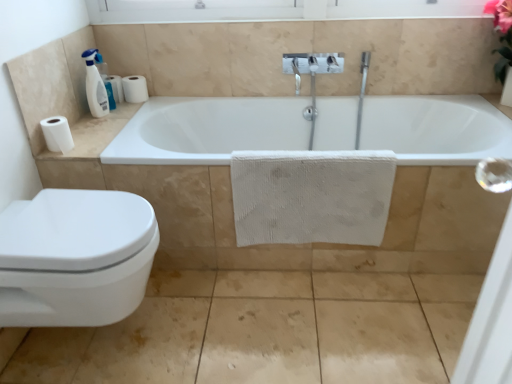
What is the approximate height of white glossy toilet at lower left?

It is 17.34 inches.

In order to face white matte paper towel at left, should I rotate leftwards or rightwards?

Rotate left and turn 19.832 degrees.

Identify the location of white matte toilet paper at left, the 1th toilet paper from the top. This screenshot has height=384, width=512. (116, 87).

Where is `white glossy toilet at lower left`? white glossy toilet at lower left is located at coordinates (74, 257).

From the image's perspective, does white matte paper towel at left appear higher than white textured towel at center?

Yes, from the image's perspective, white matte paper towel at left is above white textured towel at center.

Looking at their sizes, would you say white matte paper towel at left is wider or thinner than white textured towel at center?

Clearly, white matte paper towel at left has more width compared to white textured towel at center.

Is white matte paper towel at left to the left of white textured towel at center from the viewer's perspective?

Yes, white matte paper towel at left is to the left of white textured towel at center.

Considering the relative sizes of white matte toilet paper at upper left, the 2th toilet paper ordered from the bottom, and white plastic bottle at upper left in the image provided, is white matte toilet paper at upper left, the 2th toilet paper ordered from the bottom, wider than white plastic bottle at upper left?

Correct, the width of white matte toilet paper at upper left, the 2th toilet paper ordered from the bottom, exceeds that of white plastic bottle at upper left.

Is white matte toilet paper at upper left, acting as the 2th toilet paper starting from the back, at the right side of white plastic bottle at upper left?

Yes, white matte toilet paper at upper left, acting as the 2th toilet paper starting from the back, is to the right of white plastic bottle at upper left.

From a real-world perspective, which is physically below, white matte toilet paper at upper left, arranged as the 2th toilet paper when viewed from the front, or white plastic bottle at upper left?

In real-world perspective, white matte toilet paper at upper left, arranged as the 2th toilet paper when viewed from the front, is lower.

Is white matte toilet paper at upper left, marked as the 2th toilet paper in a top-to-bottom arrangement, taller than white plastic bottle at upper left?

No, white matte toilet paper at upper left, marked as the 2th toilet paper in a top-to-bottom arrangement, is not taller than white plastic bottle at upper left.

Between white glossy bathtub at center and white matte toilet paper at upper left, the 2th toilet paper ordered from the bottom, which one has more height?

white glossy bathtub at center.

How much distance is there between white glossy bathtub at center and white matte toilet paper at upper left, arranged as the 2th toilet paper when viewed from the front?

white glossy bathtub at center and white matte toilet paper at upper left, arranged as the 2th toilet paper when viewed from the front, are 38.56 inches apart from each other.

Are white glossy bathtub at center and white matte toilet paper at upper left, the 2th toilet paper ordered from the bottom, beside each other?

No, white glossy bathtub at center is not in contact with white matte toilet paper at upper left, the 2th toilet paper ordered from the bottom.

Identify the location of bath below the white matte toilet paper at upper left, marked as the 2th toilet paper in a top-to-bottom arrangement (from the image's perspective). The height and width of the screenshot is (384, 512). (326, 243).

Can you confirm if white matte toilet paper at upper left, acting as the 2th toilet paper starting from the back, is wider than white glossy bathtub at center?

In fact, white matte toilet paper at upper left, acting as the 2th toilet paper starting from the back, might be narrower than white glossy bathtub at center.

Which is nearer, (145,100) or (151,176)?

Point (145,100) appears to be farther away from the viewer than point (151,176).

From the image's perspective, between white matte toilet paper at upper left, acting as the 2th toilet paper starting from the back, and white glossy bathtub at center, who is located below?

white glossy bathtub at center, from the image's perspective.

Considering the positions of objects white matte toilet paper at upper left, acting as the 2th toilet paper starting from the back, and white glossy bathtub at center in the image provided, who is in front, white matte toilet paper at upper left, acting as the 2th toilet paper starting from the back, or white glossy bathtub at center?

white glossy bathtub at center.

Consider the image. Considering the sizes of objects white glossy bathtub at center and white textured towel at center in the image provided, who is bigger, white glossy bathtub at center or white textured towel at center?

Bigger between the two is white glossy bathtub at center.

Locate an element on the screen. Image resolution: width=512 pixels, height=384 pixels. bath towel behind the white glossy bathtub at center is located at coordinates (311, 196).

Which is more to the right, white glossy bathtub at center or white textured towel at center?

Positioned to the right is white glossy bathtub at center.

Between white matte toilet paper at left, the 1th toilet paper from the top, and white glossy toilet at lower left, which one appears on the right side from the viewer's perspective?

white glossy toilet at lower left is more to the right.

From a real-world perspective, is white matte toilet paper at left, the 1th toilet paper from the back, above or below white glossy toilet at lower left?

white matte toilet paper at left, the 1th toilet paper from the back, is above white glossy toilet at lower left.

Is white matte toilet paper at left, positioned as the third toilet paper in front-to-back order, oriented away from white glossy toilet at lower left?

No, white matte toilet paper at left, positioned as the third toilet paper in front-to-back order,'s orientation is not away from white glossy toilet at lower left.

Is white matte toilet paper at left, positioned as the third toilet paper in front-to-back order, taller or shorter than white glossy toilet at lower left?

Clearly, white matte toilet paper at left, positioned as the third toilet paper in front-to-back order, is shorter compared to white glossy toilet at lower left.

Is white glossy toilet at lower left positioned far away from white matte paper towel at left?

No, white glossy toilet at lower left is in close proximity to white matte paper towel at left.

Does white glossy toilet at lower left come in front of white matte paper towel at left?

Yes, it is in front of white matte paper towel at left.

Can you confirm if white glossy toilet at lower left is shorter than white matte paper towel at left?

In fact, white glossy toilet at lower left may be taller than white matte paper towel at left.

Where is `counter top located above the white textured towel at center (from the image's perspective)`? counter top located above the white textured towel at center (from the image's perspective) is located at coordinates (94, 134).

Where is `soap dispenser in front of the white matte toilet paper at upper left, arranged as the 2th toilet paper when viewed from the front`? soap dispenser in front of the white matte toilet paper at upper left, arranged as the 2th toilet paper when viewed from the front is located at coordinates (95, 84).

Which object lies nearer to the anchor point white glossy bathtub at center, white textured towel at center or white matte toilet paper at left, acting as the third toilet paper starting from the back?

white textured towel at center.

Looking at the image, which one is located closer to white matte toilet paper at left, which is counted as the first toilet paper, starting from the front, white matte toilet paper at upper left, marked as the 2th toilet paper in a top-to-bottom arrangement, or white textured towel at center?

white matte toilet paper at upper left, marked as the 2th toilet paper in a top-to-bottom arrangement, is positioned closer to the anchor white matte toilet paper at left, which is counted as the first toilet paper, starting from the front.

From the image, which object appears to be farther from white matte paper towel at left, white matte toilet paper at left, the 1th toilet paper from the top, or matte beige tile at lower left?

matte beige tile at lower left.

In the scene shown: Looking at the image, which one is located further to matte beige tile at lower left, white matte toilet paper at left, which appears as the third toilet paper when viewed from the top, or white matte toilet paper at upper left, acting as the 2th toilet paper starting from the back?

white matte toilet paper at upper left, acting as the 2th toilet paper starting from the back, is further to matte beige tile at lower left.

Based on their spatial positions, is white matte toilet paper at left, which is counted as the first toilet paper, starting from the front, or white glossy toilet at lower left closer to white plastic bottle at upper left?

Based on the image, white matte toilet paper at left, which is counted as the first toilet paper, starting from the front, appears to be nearer to white plastic bottle at upper left.

Consider the image. From the image, which object appears to be nearer to white matte paper towel at left, white plastic bottle at upper left or matte beige tile at lower left?

Based on the image, white plastic bottle at upper left appears to be nearer to white matte paper towel at left.

From the image, which object appears to be farther from white glossy bathtub at center, white matte toilet paper at left, the 1th toilet paper from the top, or white matte toilet paper at left, which appears as the third toilet paper when viewed from the top?

white matte toilet paper at left, the 1th toilet paper from the top, is further to white glossy bathtub at center.

Looking at the image, which one is located further to white plastic bottle at upper left, white glossy bathtub at center or white matte toilet paper at left, the 1th toilet paper from the top?

Among the two, white glossy bathtub at center is located further to white plastic bottle at upper left.

What are the coordinates of `counter top between white glossy toilet at lower left and white matte toilet paper at left, positioned as the third toilet paper in front-to-back order, in the front-back direction` in the screenshot? It's located at (94, 134).

The image size is (512, 384). Find the location of `bath between white matte toilet paper at upper left, arranged as the 2th toilet paper when viewed from the front, and matte beige tile at lower left vertically`. bath between white matte toilet paper at upper left, arranged as the 2th toilet paper when viewed from the front, and matte beige tile at lower left vertically is located at coordinates (326, 243).

Image resolution: width=512 pixels, height=384 pixels. I want to click on bath towel located between white plastic bottle at upper left and white glossy bathtub at center in the left-right direction, so click(311, 196).

Find the location of `concrete between white matte toilet paper at left, acting as the third toilet paper starting from the back, and white glossy bathtub at center from left to right`. concrete between white matte toilet paper at left, acting as the third toilet paper starting from the back, and white glossy bathtub at center from left to right is located at coordinates (265, 331).